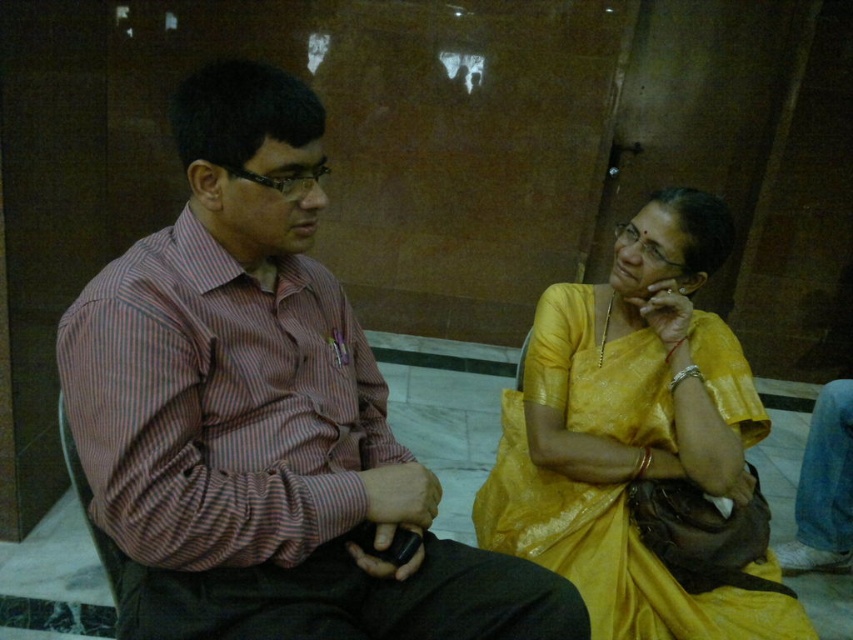
You are designing a seating arrangement for a meeting where the striped cotton shirt at left and the matte yellow saree at right will be present. Considering their sizes, which object should be placed closer to the center of the table to balance the visual weight?

The striped cotton shirt at left has a smaller size compared to the matte yellow saree at right. To balance the visual weight, the larger matte yellow saree at right should be placed closer to the center of the table.

Consider the image. You are a photographer trying to capture a candid shot of both the striped cotton shirt at left and the matte yellow saree at right. Since you want to ensure both are clearly visible in the frame, which object should you focus on first to ensure depth of field?

The striped cotton shirt at left is in front of the matte yellow saree at right, so focusing on the striped cotton shirt at left first will ensure both are in focus due to its closer position to the camera.

You are a photographer standing in front of the scene. You want to take a photo that includes both the striped cotton shirt at left and the matte yellow saree at right. The camera you are using has a maximum focus range of 24 inches. Will the two subjects be in focus if you position yourself exactly between them?

The distance between the striped cotton shirt at left and the matte yellow saree at right is 23.95 inches, which is just under the camera maximum focus range of 24 inches. Therefore, positioning yourself exactly between them will ensure both subjects are in focus.